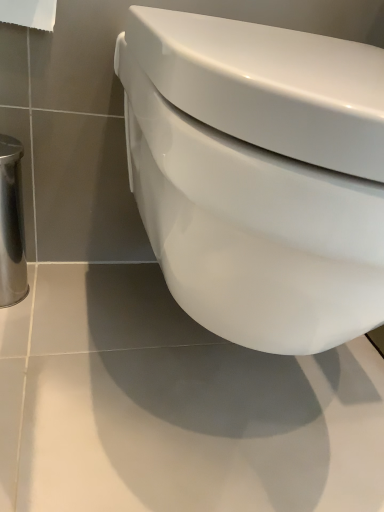
Question: Looking at their shapes, would you say white glossy toilet at center is wider or thinner than white paper at upper left?

Choices:
 (A) wide
 (B) thin

Answer: (A)

Question: From a real-world perspective, relative to white paper at upper left, is white glossy toilet at center vertically above or below?

Choices:
 (A) below
 (B) above

Answer: (A)

Question: Choose the correct answer: Is white glossy toilet at center inside white paper at upper left or outside it?

Choices:
 (A) inside
 (B) outside

Answer: (B)

Question: Would you say white paper at upper left is to the left or to the right of white glossy toilet at center in the picture?

Choices:
 (A) left
 (B) right

Answer: (A)

Question: Choose the correct answer: Is white paper at upper left inside white glossy toilet at center or outside it?

Choices:
 (A) inside
 (B) outside

Answer: (B)

Question: Is white paper at upper left in front of or behind white glossy toilet at center in the image?

Choices:
 (A) front
 (B) behind

Answer: (B)

Question: From the image's perspective, is white paper at upper left above or below white glossy toilet at center?

Choices:
 (A) above
 (B) below

Answer: (A)